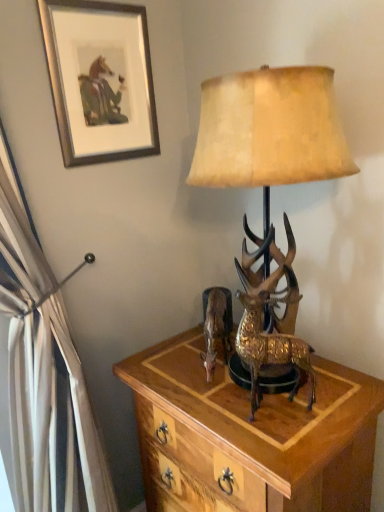
Find the location of a particular element. The height and width of the screenshot is (512, 384). metallic gold reindeer at center is located at coordinates (216, 326).

What do you see at coordinates (250, 435) in the screenshot? The height and width of the screenshot is (512, 384). I see `wooden nightstand at center` at bounding box center [250, 435].

The height and width of the screenshot is (512, 384). What do you see at coordinates (100, 80) in the screenshot? I see `silver metallic picture frame at upper left` at bounding box center [100, 80].

Identify the location of metallic gold reindeer at center. (216, 326).

Is silver metallic picture frame at upper left spatially inside wooden nightstand at center, or outside of it?

The correct answer is: outside.

This screenshot has height=512, width=384. In order to click on nightstand below the silver metallic picture frame at upper left (from a real-world perspective) in this screenshot , I will do `click(250, 435)`.

Can you confirm if silver metallic picture frame at upper left is bigger than wooden nightstand at center?

No, silver metallic picture frame at upper left is not bigger than wooden nightstand at center.

Which is in front, point (108, 35) or point (270, 434)?

The point (270, 434) is in front.

Can you tell me how much wooden nightstand at center and silver metallic picture frame at upper left differ in facing direction?

89.5 degrees separate the facing orientations of wooden nightstand at center and silver metallic picture frame at upper left.

Is wooden nightstand at center not near silver metallic picture frame at upper left?

No.

Image resolution: width=384 pixels, height=512 pixels. Find the location of `nightstand beneath the silver metallic picture frame at upper left (from a real-world perspective)`. nightstand beneath the silver metallic picture frame at upper left (from a real-world perspective) is located at coordinates (250, 435).

Can you confirm if wooden nightstand at center is shorter than silver metallic picture frame at upper left?

Incorrect, the height of wooden nightstand at center does not fall short of that of silver metallic picture frame at upper left.

From the image's perspective, is metallic gold reindeer at center below wooden nightstand at center?

No, from the image's perspective, metallic gold reindeer at center is not beneath wooden nightstand at center.

From a real-world perspective, is metallic gold reindeer at center positioned under wooden nightstand at center based on gravity?

Incorrect, from a real-world perspective, metallic gold reindeer at center is higher than wooden nightstand at center.

Is metallic gold reindeer at center situated inside wooden nightstand at center or outside?

metallic gold reindeer at center is located beyond the bounds of wooden nightstand at center.

Based on the photo, which object is positioned more to the left, metallic gold reindeer at center or wooden nightstand at center?

Positioned to the left is metallic gold reindeer at center.

From a real-world perspective, does wooden nightstand at center stand above gold textured deer at center?

Incorrect, from a real-world perspective, wooden nightstand at center is lower than gold textured deer at center.

Which of these two, wooden nightstand at center or gold textured deer at center, is bigger?

With larger size is wooden nightstand at center.

From the picture: Is wooden nightstand at center in front of gold textured deer at center?

No, wooden nightstand at center is behind gold textured deer at center.

Could you tell me if wooden nightstand at center is facing gold textured deer at center?

No, wooden nightstand at center is not turned towards gold textured deer at center.

In terms of width, does gold textured deer at center look wider or thinner when compared to wooden nightstand at center?

Considering their sizes, gold textured deer at center looks slimmer than wooden nightstand at center.

Between point (266, 189) and point (209, 481), which one is positioned behind?

The point (266, 189) is more distant.

How different are the orientations of gold textured deer at center and wooden nightstand at center in degrees?

The angular difference between gold textured deer at center and wooden nightstand at center is 0.561 degrees.

Is the surface of gold textured deer at center in direct contact with wooden nightstand at center?

No, gold textured deer at center is not beside wooden nightstand at center.

Considering the relative sizes of silver metallic picture frame at upper left and metallic gold reindeer at center in the image provided, is silver metallic picture frame at upper left bigger than metallic gold reindeer at center?

Correct, silver metallic picture frame at upper left is larger in size than metallic gold reindeer at center.

The height and width of the screenshot is (512, 384). What are the coordinates of `reindeer in front of the silver metallic picture frame at upper left` in the screenshot? It's located at tap(216, 326).

Is silver metallic picture frame at upper left at the right side of metallic gold reindeer at center?

In fact, silver metallic picture frame at upper left is to the left of metallic gold reindeer at center.

From the picture: From the image's perspective, is silver metallic picture frame at upper left located above or below metallic gold reindeer at center?

Clearly, from the image's perspective, silver metallic picture frame at upper left is above metallic gold reindeer at center.

From the image's perspective, who appears lower, gold textured deer at center or wooden nightstand at center?

wooden nightstand at center is shown below in the image.

This screenshot has width=384, height=512. Find the location of `deer lying behind the wooden nightstand at center`. deer lying behind the wooden nightstand at center is located at coordinates (270, 317).

From a real-world perspective, who is located higher, gold textured deer at center or wooden nightstand at center?

In real-world perspective, gold textured deer at center is above.

At what (x,y) coordinates should I click in order to perform the action: click on picture frame located above the wooden nightstand at center (from a real-world perspective). Please return your answer as a coordinate pair (x, y). The height and width of the screenshot is (512, 384). Looking at the image, I should click on (100, 80).

Locate an element on the screen. The height and width of the screenshot is (512, 384). nightstand below the silver metallic picture frame at upper left (from the image's perspective) is located at coordinates (250, 435).

Looking at this image, considering their positions, is silver metallic picture frame at upper left positioned further to wooden nightstand at center than gold textured deer at center?

silver metallic picture frame at upper left is further to wooden nightstand at center.

Estimate the real-world distances between objects in this image. Which object is closer to gold textured deer at center, gold textured deer at center or metallic gold reindeer at center?

gold textured deer at center is closer to gold textured deer at center.

Looking at the image, which one is located closer to metallic gold reindeer at center, gold textured deer at center or wooden nightstand at center?

wooden nightstand at center lies closer to metallic gold reindeer at center than the other object.

Considering their positions, is wooden nightstand at center positioned closer to metallic gold reindeer at center than gold textured deer at center?

The object closer to metallic gold reindeer at center is gold textured deer at center.

Based on their spatial positions, is wooden nightstand at center or metallic gold reindeer at center further from silver metallic picture frame at upper left?

The object further to silver metallic picture frame at upper left is wooden nightstand at center.

Based on their spatial positions, is silver metallic picture frame at upper left or wooden nightstand at center closer to gold textured deer at center?

silver metallic picture frame at upper left lies closer to gold textured deer at center than the other object.

When comparing their distances from gold textured deer at center, does gold textured deer at center or silver metallic picture frame at upper left seem further?

A: silver metallic picture frame at upper left.

Considering their positions, is wooden nightstand at center positioned closer to metallic gold reindeer at center than gold textured deer at center?

Based on the image, wooden nightstand at center appears to be nearer to metallic gold reindeer at center.

This screenshot has height=512, width=384. I want to click on deer between silver metallic picture frame at upper left and metallic gold reindeer at center from top to bottom, so click(270, 317).

Identify the location of deer that lies between silver metallic picture frame at upper left and wooden nightstand at center from top to bottom. (270, 317).

At what (x,y) coordinates should I click in order to perform the action: click on reindeer between gold textured deer at center and wooden nightstand at center vertically. Please return your answer as a coordinate pair (x, y). Looking at the image, I should click on (216, 326).

The image size is (384, 512). In order to click on reindeer between silver metallic picture frame at upper left and wooden nightstand at center from top to bottom in this screenshot , I will do `click(216, 326)`.